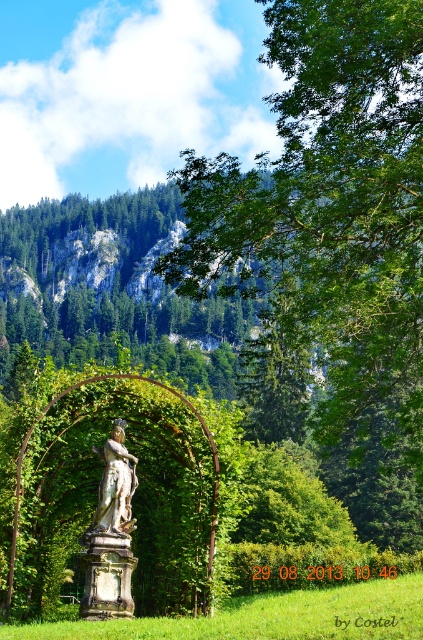
Question: Which object appears farthest from the camera in this image?

Choices:
 (A) white marble statue at center
 (B) bronze statue at center

Answer: (A)

Question: Which point is closer to the camera taking this photo?

Choices:
 (A) (125, 477)
 (B) (129, 470)

Answer: (A)

Question: Which object appears farthest from the camera in this image?

Choices:
 (A) bronze statue at center
 (B) white marble statue at center

Answer: (B)

Question: Where is bronze statue at center located in relation to white marble statue at center in the image?

Choices:
 (A) below
 (B) above

Answer: (A)

Question: Does bronze statue at center have a lesser width compared to white marble statue at center?

Choices:
 (A) yes
 (B) no

Answer: (B)

Question: Is bronze statue at center to the right of white marble statue at center from the viewer's perspective?

Choices:
 (A) yes
 (B) no

Answer: (B)